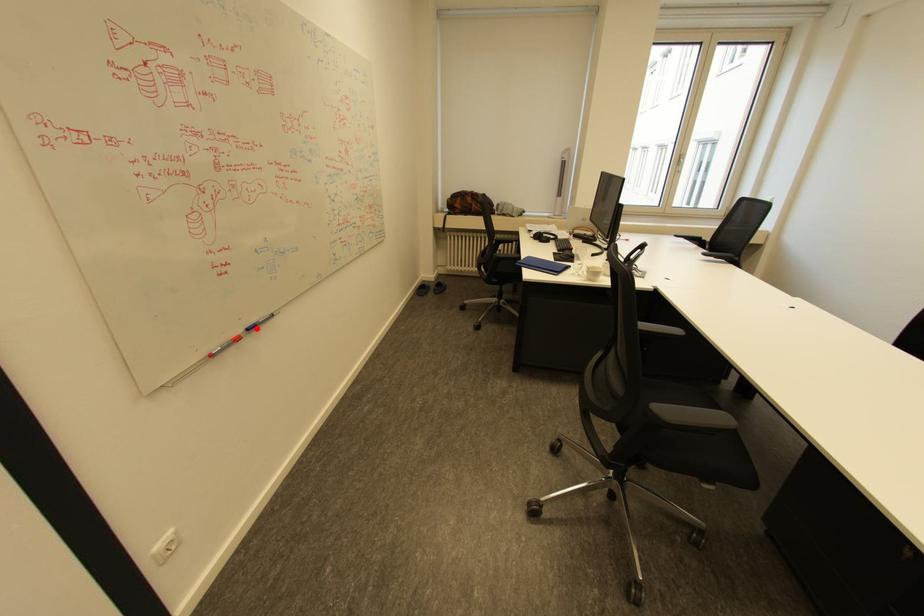
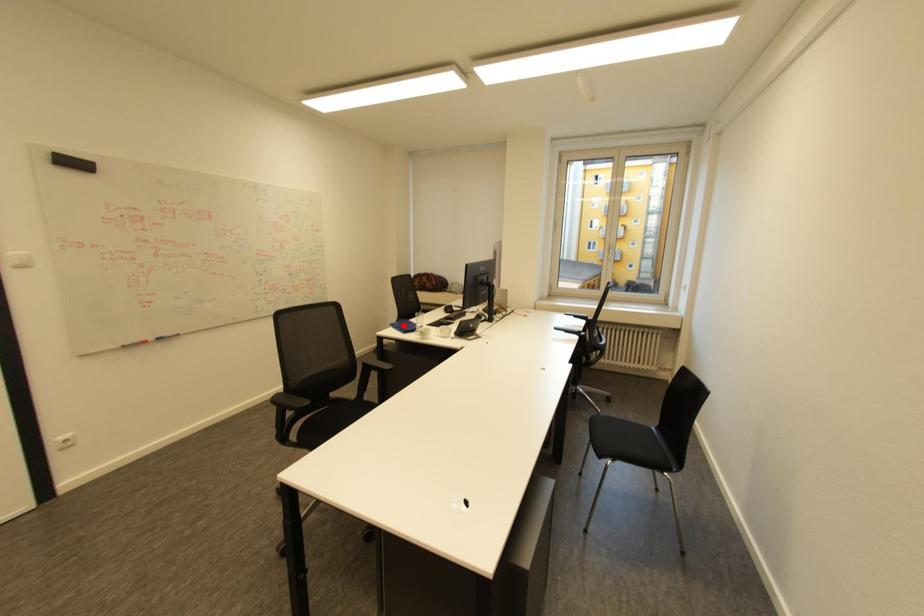
I am providing you with two images of the same scene from different viewpoints. A red point is marked on the first image and another point is marked on the second image. Is the red point in image1 aligned with the point shown in image2?

No